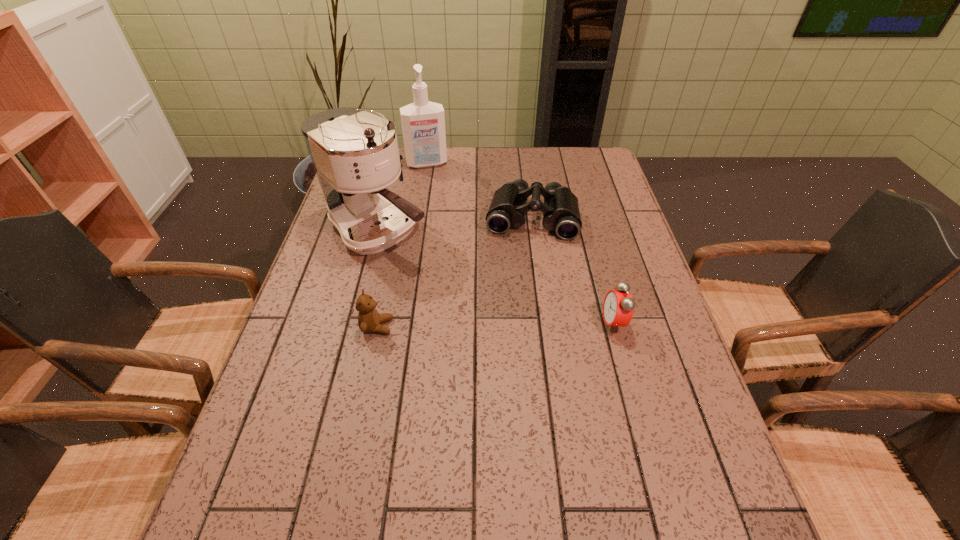
Locate an element on the screen. vacant area that lies between the alarm clock and the coffee maker is located at coordinates (496, 277).

The height and width of the screenshot is (540, 960). I want to click on unoccupied area between the binoculars and the alarm clock, so click(x=572, y=270).

Where is `free space between the coffee maker and the cleansing agent`? free space between the coffee maker and the cleansing agent is located at coordinates (403, 197).

The height and width of the screenshot is (540, 960). I want to click on free point between the alarm clock and the teddy bear, so click(x=495, y=325).

Locate an element on the screen. empty space that is in between the alarm clock and the coffee maker is located at coordinates (496, 277).

You are a GUI agent. You are given a task and a screenshot of the screen. Output one action in this format:
    pyautogui.click(x=<x>, y=<y>)
    Task: Click on the unoccupied area between the teddy bear and the binoculars
    The image size is (960, 540).
    Given the screenshot: What is the action you would take?
    pyautogui.click(x=454, y=272)

I want to click on object identified as the closest to the coffee maker, so click(560, 209).

Find the location of a particular element. The height and width of the screenshot is (540, 960). object that is the nearest to the binoculars is located at coordinates (355, 154).

You are a GUI agent. You are given a task and a screenshot of the screen. Output one action in this format:
    pyautogui.click(x=<x>, y=<y>)
    Task: Click on the vacant space that satisfies the following two spatial constraints: 1. on the front side of the farthest object; 2. on the front-facing side of the alarm clock
    Image resolution: width=960 pixels, height=540 pixels.
    Given the screenshot: What is the action you would take?
    pyautogui.click(x=401, y=323)

You are a GUI agent. You are given a task and a screenshot of the screen. Output one action in this format:
    pyautogui.click(x=<x>, y=<y>)
    Task: Click on the vacant point that satisfies the following two spatial constraints: 1. on the front side of the teddy bear; 2. on the front-facing side of the coffee maker
    The image size is (960, 540).
    Given the screenshot: What is the action you would take?
    pyautogui.click(x=354, y=327)